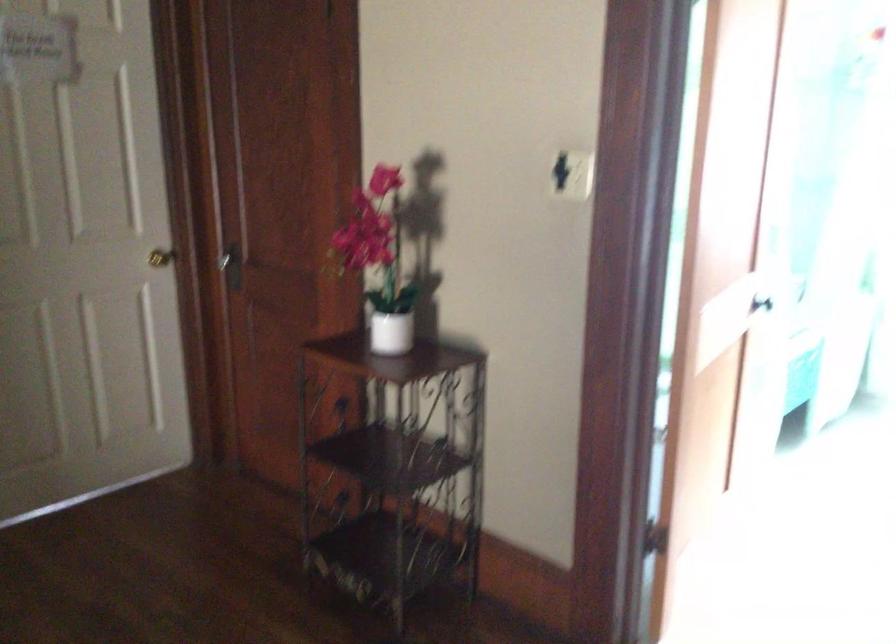
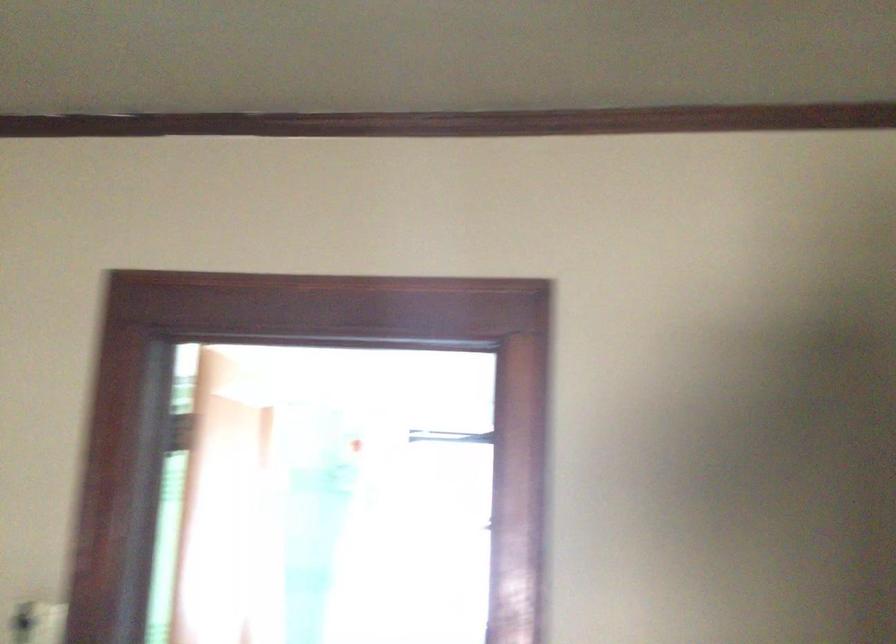
The point at (574, 166) is marked in the first image. Where is the corresponding point in the second image?

(36, 623)